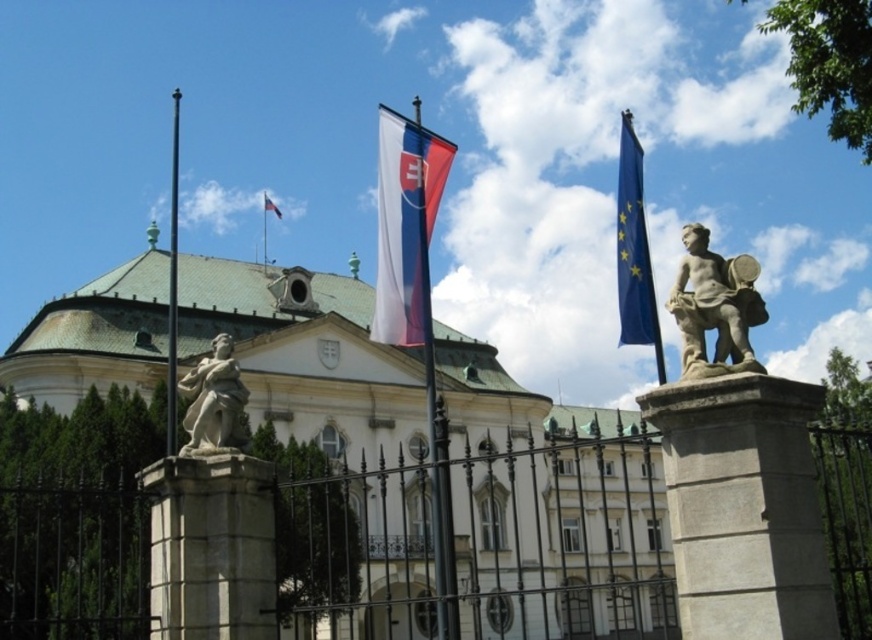
Question: Does white flagpole at upper center have a larger size compared to red fabric flag at center?

Choices:
 (A) no
 (B) yes

Answer: (B)

Question: Which object is farther from the camera taking this photo?

Choices:
 (A) black metal flag pole at left
 (B) black wrought iron fence at center

Answer: (A)

Question: Is white fabric flag at center smaller than stone statue at upper right?

Choices:
 (A) yes
 (B) no

Answer: (B)

Question: Which point is closer to the camera?

Choices:
 (A) white marble statue at left
 (B) white flagpole at upper center

Answer: (A)

Question: Considering the real-world distances, which object is closest to the red fabric flag at center?

Choices:
 (A) white marble statue at left
 (B) black wrought iron fence at center
 (C) stone statue at upper right

Answer: (B)

Question: Is black wrought iron fence at center above blue fabric flag at upper right?

Choices:
 (A) no
 (B) yes

Answer: (A)